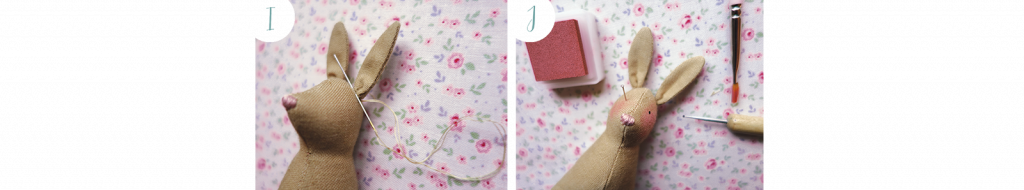
I want to click on surface, so [x=442, y=16].